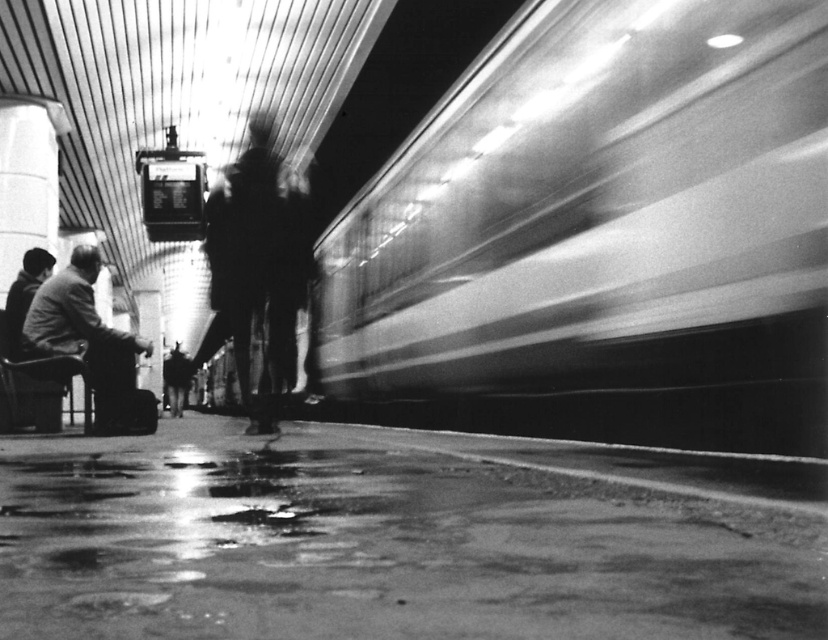
From the picture: You are a passenger waiting at the train station and see the smooth metallic train at right and the dark gray wool coat at lower left. Which object is closer to the ceiling?

The smooth metallic train at right is positioned under the dark gray wool coat at lower left, so the dark gray wool coat at lower left is closer to the ceiling.

You are standing at the center of the platform and see a point marked at coordinates (599,234). Based on the scene description, can you determine what object this point is located on?

The point at coordinates (599,234) is located on the smooth metallic train at right.